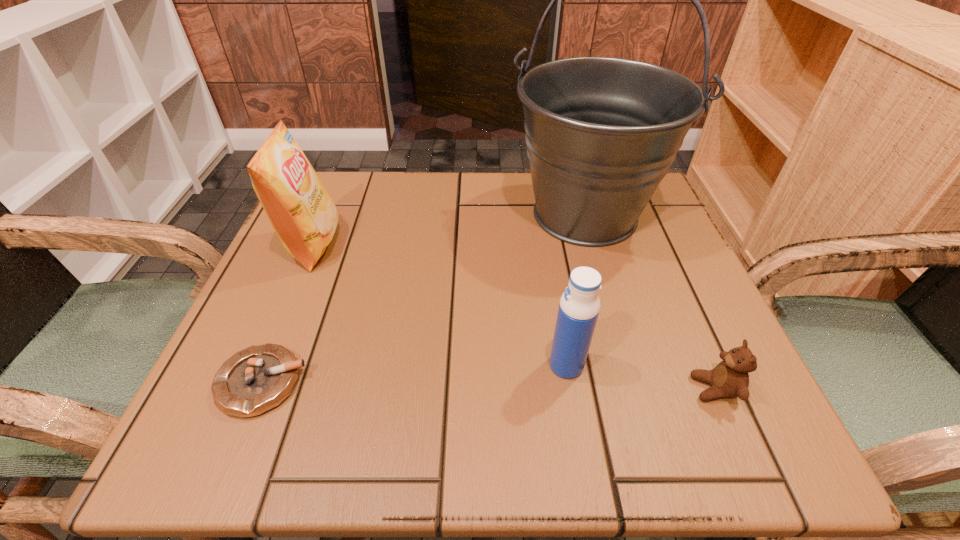
Select which object appears as the third closest to the water bottle. Please provide its 2D coordinates. Your answer should be formatted as a tuple, i.e. [(x, y)], where the tuple contains the x and y coordinates of a point satisfying the conditions above.

[(257, 379)]

Point out which object is positioned as the second nearest to the ashtray. Please provide its 2D coordinates. Your answer should be formatted as a tuple, i.e. [(x, y)], where the tuple contains the x and y coordinates of a point satisfying the conditions above.

[(579, 306)]

You are a GUI agent. You are given a task and a screenshot of the screen. Output one action in this format:
    pyautogui.click(x=<x>, y=<y>)
    Task: Click on the free space that satisfies the following two spatial constraints: 1. on the front-facing side of the crisp (potato chip); 2. on the back side of the water bottle
    Image resolution: width=960 pixels, height=540 pixels.
    Given the screenshot: What is the action you would take?
    pyautogui.click(x=263, y=365)

Image resolution: width=960 pixels, height=540 pixels. Identify the location of free space that satisfies the following two spatial constraints: 1. on the front-facing side of the crisp (potato chip); 2. on the back side of the water bottle. (263, 365).

In order to click on free region that satisfies the following two spatial constraints: 1. on the front-facing side of the ashtray; 2. on the right side of the crisp (potato chip) in this screenshot , I will do pyautogui.click(x=255, y=382).

Image resolution: width=960 pixels, height=540 pixels. What are the coordinates of `vacant space that satisfies the following two spatial constraints: 1. on the back side of the third tallest object; 2. on the left side of the ashtray` in the screenshot? It's located at click(x=269, y=365).

In order to click on free space that satisfies the following two spatial constraints: 1. on the front-facing side of the third tallest object; 2. on the right side of the crisp (potato chip) in this screenshot , I will do `click(263, 365)`.

You are a GUI agent. You are given a task and a screenshot of the screen. Output one action in this format:
    pyautogui.click(x=<x>, y=<y>)
    Task: Click on the vacant position in the image that satisfies the following two spatial constraints: 1. on the front-facing side of the fourth shortest object; 2. on the left side of the water bottle
    The width and height of the screenshot is (960, 540).
    Given the screenshot: What is the action you would take?
    pyautogui.click(x=263, y=365)

Where is `free space that satisfies the following two spatial constraints: 1. on the front-facing side of the water bottle; 2. on the right side of the crisp (potato chip)`? The image size is (960, 540). free space that satisfies the following two spatial constraints: 1. on the front-facing side of the water bottle; 2. on the right side of the crisp (potato chip) is located at coordinates (263, 365).